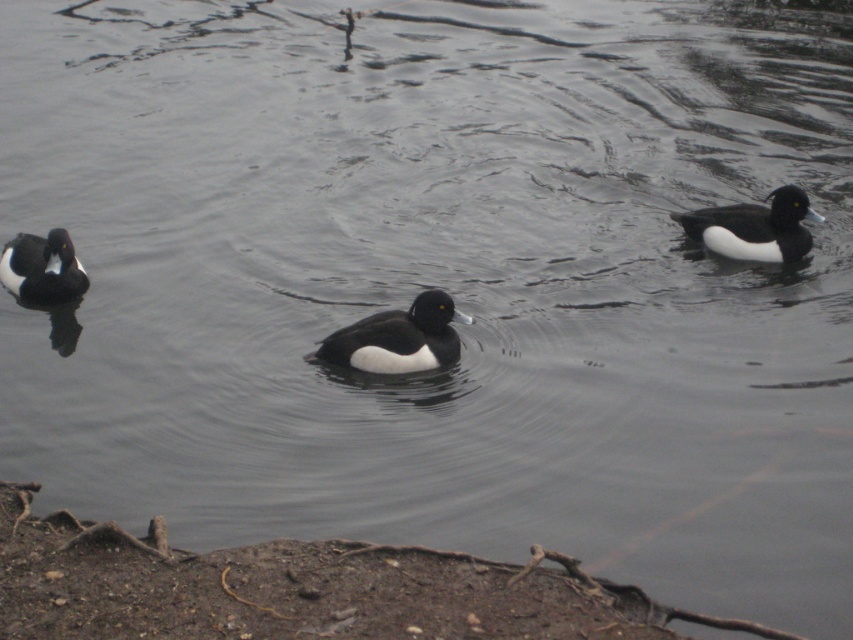
You are a wildlife photographer aiming to capture a closeup shot of the black glossy duck at center and the white matte duck at right. Your camera has a maximum focus range of 3 meters. Can you photograph both ducks in the same frame without moving your position?

The distance between the black glossy duck at center and the white matte duck at right is 2.91 meters, which is within the camera maximum focus range of 3 meters. Therefore, you can photograph both ducks in the same frame without moving your position.